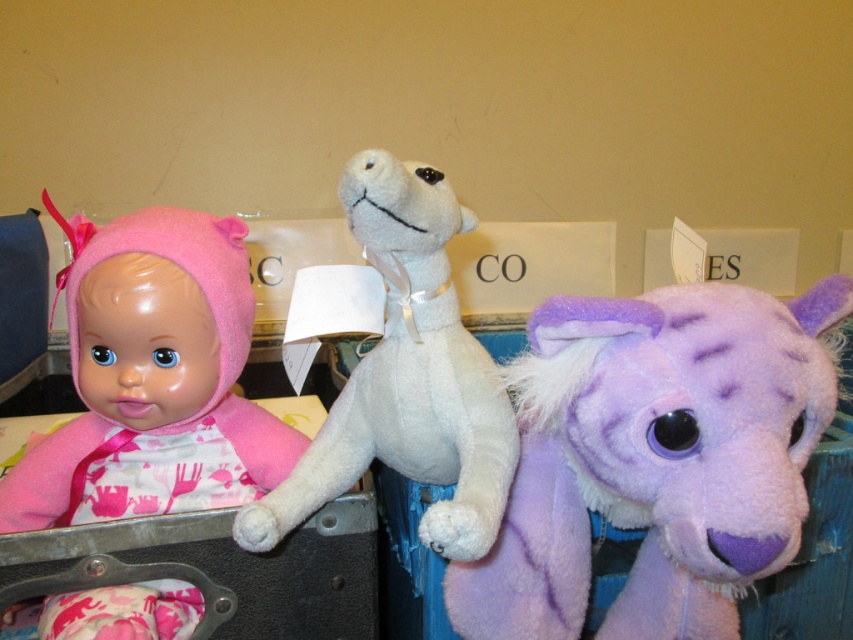
Question: Is purple plush horse at right wider than white soft stuffed animal at center?

Choices:
 (A) yes
 (B) no

Answer: (A)

Question: From the image, what is the correct spatial relationship of purple plush horse at right in relation to matte pink fabric doll at left?

Choices:
 (A) left
 (B) right

Answer: (B)

Question: Among these points, which one is nearest to the camera?

Choices:
 (A) (80, 381)
 (B) (635, 323)
 (C) (386, 180)

Answer: (B)

Question: Which point appears farthest from the camera in this image?

Choices:
 (A) (410, 266)
 (B) (664, 406)
 (C) (47, 483)

Answer: (C)

Question: Which is nearer to the white soft stuffed animal at center?

Choices:
 (A) matte pink fabric doll at left
 (B) purple plush horse at right

Answer: (B)

Question: Can you confirm if purple plush horse at right is positioned below white soft stuffed animal at center?

Choices:
 (A) no
 (B) yes

Answer: (B)